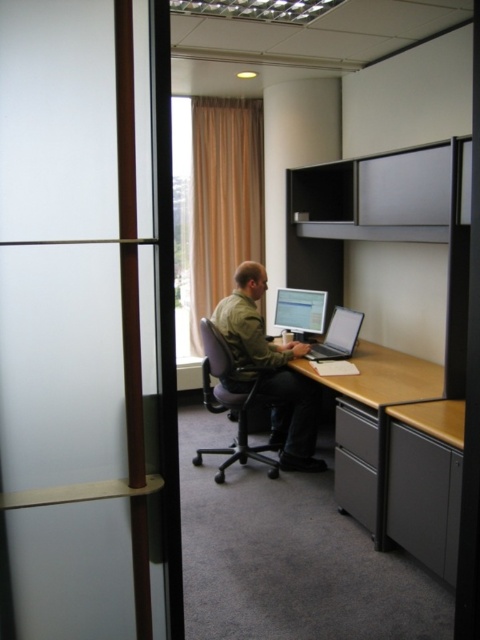
Question: Is green matte jacket at center positioned at the back of silver metallic laptop at center?

Choices:
 (A) no
 (B) yes

Answer: (A)

Question: Which of the following is the farthest from the observer?

Choices:
 (A) green matte jacket at center
 (B) wooden at center
 (C) wooden desk at lower right

Answer: (A)

Question: Which is farther from the purple fabric swivel chair at center?

Choices:
 (A) silver metallic laptop at center
 (B) wooden desk at lower right
 (C) wooden at center
 (D) matte black monitor at center

Answer: (B)

Question: Can you confirm if matte black monitor at center is smaller than silver metallic laptop at center?

Choices:
 (A) no
 (B) yes

Answer: (B)

Question: Which point appears farthest from the camera in this image?

Choices:
 (A) (444, 538)
 (B) (300, 412)
 (C) (296, 298)
 (D) (335, 326)

Answer: (C)

Question: Is green matte jacket at center wider than wooden at center?

Choices:
 (A) yes
 (B) no

Answer: (B)